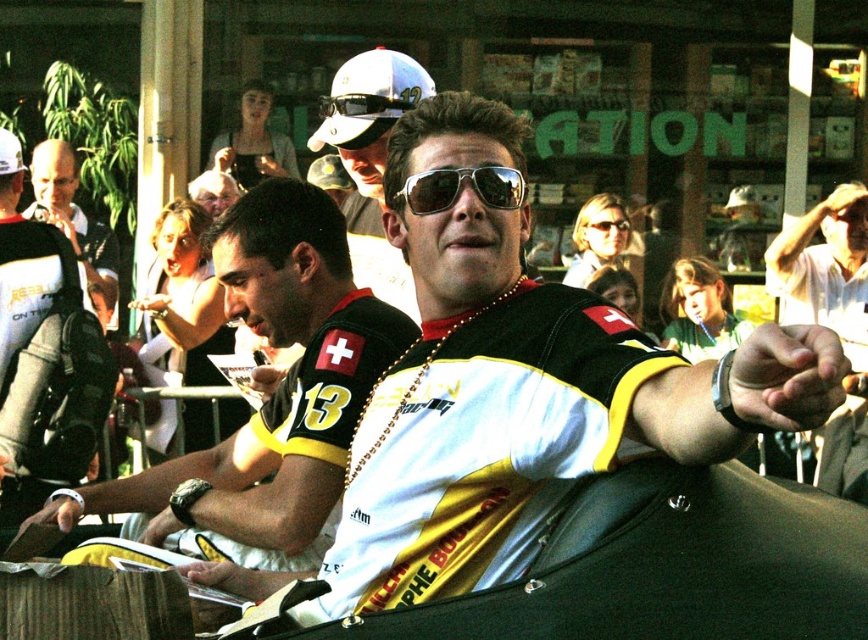
Does sunglasses at center appear under shiny black sunglasses at center?

Correct, sunglasses at center is located below shiny black sunglasses at center.

Can you confirm if sunglasses at center is bigger than shiny black sunglasses at center?

Actually, sunglasses at center might be smaller than shiny black sunglasses at center.

Where is `sunglasses at center`? Image resolution: width=868 pixels, height=640 pixels. sunglasses at center is located at coordinates (459, 188).

Find the location of a particular element. This screenshot has height=640, width=868. sunglasses at center is located at coordinates 459,188.

Is the position of yellow jersey at center more distant than that of matte black camera at left?

No, yellow jersey at center is in front of matte black camera at left.

Find the location of a particular element. yellow jersey at center is located at coordinates (273, 392).

Where is `yellow jersey at center`? Image resolution: width=868 pixels, height=640 pixels. yellow jersey at center is located at coordinates (273, 392).

Measure the distance between white jersey at center and shiny black sunglasses at center.

3.82 meters

Where is `white jersey at center`? This screenshot has width=868, height=640. white jersey at center is located at coordinates (528, 410).